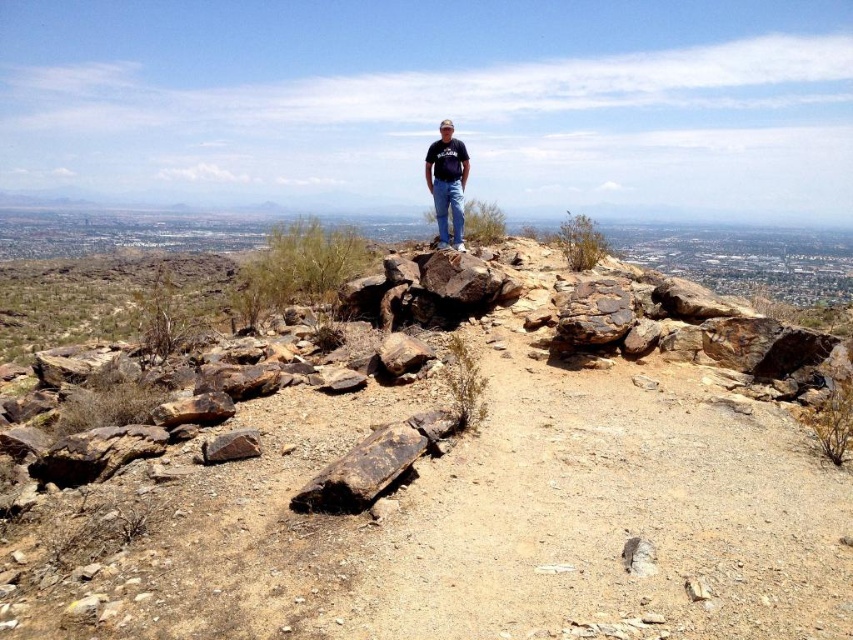
Question: Which object is positioned farthest from the brown rough rock at lower left?

Choices:
 (A) brown rocky hillside at center
 (B) black cotton shirt at center

Answer: (B)

Question: Is brown rocky hillside at center to the left of black cotton shirt at center from the viewer's perspective?

Choices:
 (A) no
 (B) yes

Answer: (B)

Question: Based on their relative distances, which object is nearer to the brown rocky hillside at center?

Choices:
 (A) black cotton shirt at center
 (B) brown rough rock at lower left

Answer: (B)

Question: Which object appears closest to the camera in this image?

Choices:
 (A) brown rocky hillside at center
 (B) brown rough rock at lower left

Answer: (A)

Question: Does black cotton shirt at center appear on the right side of brown rough rock at lower left?

Choices:
 (A) no
 (B) yes

Answer: (B)

Question: Does brown rocky hillside at center appear under black cotton shirt at center?

Choices:
 (A) no
 (B) yes

Answer: (B)